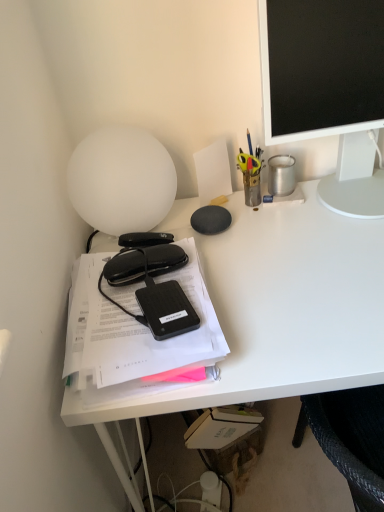
Locate an element on the screen. This screenshot has height=512, width=384. metallic silver pen holder at upper right, placed as the third stationery when sorted from front to back is located at coordinates (281, 175).

You are a GUI agent. You are given a task and a screenshot of the screen. Output one action in this format:
    pyautogui.click(x=<x>, y=<y>)
    Task: Click on the white plastic bottle at lower center, the 1th stationery when ordered from back to front
    The width and height of the screenshot is (384, 512).
    Given the screenshot: What is the action you would take?
    point(210,490)

The image size is (384, 512). What do you see at coordinates (143, 263) in the screenshot?
I see `black matte glasses case at left, the fourth stationery when ordered from right to left` at bounding box center [143, 263].

Identify the location of black matte glasses case at left, the fourth stationery when ordered from right to left. The height and width of the screenshot is (512, 384). (143, 263).

What do you see at coordinates (251, 173) in the screenshot? The width and height of the screenshot is (384, 512). I see `metallic pen holder at upper right, the third stationery positioned from the left` at bounding box center [251, 173].

Find the location of a particular element. This screenshot has width=384, height=512. black matte hardcover at left is located at coordinates (140, 327).

Describe the element at coordinates (140, 327) in the screenshot. The height and width of the screenshot is (512, 384). I see `black matte hardcover at left` at that location.

This screenshot has height=512, width=384. Identify the location of black plastic external hard drive at center. [x=166, y=309].

You are a GUI agent. You are given a task and a screenshot of the screen. Output one action in this format:
    pyautogui.click(x=<x>, y=<y>)
    Task: Click on the metallic silver pen holder at upper right, positioned as the 1th stationery in top-to-bottom order
    
    Given the screenshot: What is the action you would take?
    pyautogui.click(x=281, y=175)

Where is `document located above the white plastic bottle at lower center, which appears as the third stationery when viewed from the right (from a real-world perspective)`? document located above the white plastic bottle at lower center, which appears as the third stationery when viewed from the right (from a real-world perspective) is located at coordinates (140, 327).

Is black matte hardcover at left next to white plastic bottle at lower center, which appears as the fourth stationery when viewed from the front?

They are not placed beside each other.

Does point (84, 257) lie behind point (218, 507)?

No, it is in front of (218, 507).

From the image's perspective, which is above, black matte hardcover at left or white plastic bottle at lower center, the 1th stationery when ordered from back to front?

black matte hardcover at left is shown above in the image.

From a real-world perspective, who is located lower, metallic silver pen holder at upper right, which ranks as the fourth stationery in left-to-right order, or metallic pen holder at upper right, the third stationery positioned from the left?

metallic silver pen holder at upper right, which ranks as the fourth stationery in left-to-right order.

Which point is more distant from viewer, (294, 158) or (251, 161)?

Positioned behind is point (294, 158).

Which object is positioned more to the left, metallic silver pen holder at upper right, which ranks as the fourth stationery in left-to-right order, or metallic pen holder at upper right, the 3th stationery ordered from the bottom?

From the viewer's perspective, metallic pen holder at upper right, the 3th stationery ordered from the bottom, appears more on the left side.

Is metallic silver pen holder at upper right, which ranks as the 2th stationery in back-to-front order, thinner than metallic pen holder at upper right, which is the third stationery from back to front?

No.

Is white matte lamp at upper left next to matte black monitor at upper right and touching it?

white matte lamp at upper left and matte black monitor at upper right are clearly separated.

Between white matte lamp at upper left and matte black monitor at upper right, which one has larger width?

With larger width is matte black monitor at upper right.

Is white matte lamp at upper left not inside matte black monitor at upper right?

Yes, white matte lamp at upper left is not within matte black monitor at upper right.

Is metallic pen holder at upper right, the 3th stationery ordered from the bottom, positioned in front of black plastic external hard drive at center?

No, metallic pen holder at upper right, the 3th stationery ordered from the bottom, is behind black plastic external hard drive at center.

Does metallic pen holder at upper right, the third stationery positioned from the left, have a greater width compared to black plastic external hard drive at center?

Incorrect, the width of metallic pen holder at upper right, the third stationery positioned from the left, does not surpass that of black plastic external hard drive at center.

Is point (248, 168) positioned behind point (172, 336)?

Yes.

What's the angular difference between black matte glasses case at left, which appears as the 4th stationery when viewed from the back, and black matte hardcover at left's facing directions?

The facing directions of black matte glasses case at left, which appears as the 4th stationery when viewed from the back, and black matte hardcover at left are 13.2 degrees apart.

From the image's perspective, which stationery is the 1st one above the black matte hardcover at left? Please provide its 2D coordinates.

[(143, 263)]

Is black matte glasses case at left, the fourth stationery when ordered from right to left, not inside black matte hardcover at left?

That's incorrect, black matte glasses case at left, the fourth stationery when ordered from right to left, is not completely outside black matte hardcover at left.

Is the surface of black matte glasses case at left, the 3th stationery in the top-to-bottom sequence, in direct contact with black matte hardcover at left?

Yes.

Consider the image. Which object is more forward, black plastic external hard drive at center or white matte lamp at upper left?

Positioned in front is black plastic external hard drive at center.

Locate an element on the screen. lamp lying behind the black plastic external hard drive at center is located at coordinates (121, 180).

Between black plastic external hard drive at center and white matte lamp at upper left, which one appears on the left side from the viewer's perspective?

Positioned to the left is white matte lamp at upper left.

In the scene shown: Measure the distance from black plastic external hard drive at center to white matte lamp at upper left.

black plastic external hard drive at center is 9.47 inches away from white matte lamp at upper left.

Who is taller, white plastic bottle at lower center, positioned as the 1th stationery in bottom-to-top order, or matte black monitor at upper right?

With more height is matte black monitor at upper right.

Measure the distance from white plastic bottle at lower center, marked as the 2th stationery in a left-to-right arrangement, to matte black monitor at upper right.

white plastic bottle at lower center, marked as the 2th stationery in a left-to-right arrangement, is 3.42 feet from matte black monitor at upper right.

Considering the relative sizes of white plastic bottle at lower center, the 4th stationery in the top-to-bottom sequence, and matte black monitor at upper right in the image provided, is white plastic bottle at lower center, the 4th stationery in the top-to-bottom sequence, smaller than matte black monitor at upper right?

Yes.

From a real-world perspective, is white plastic bottle at lower center, the 4th stationery in the top-to-bottom sequence, physically above matte black monitor at upper right?

Actually, white plastic bottle at lower center, the 4th stationery in the top-to-bottom sequence, is physically below matte black monitor at upper right in the real world.

Locate an element on the screen. document on the left of white plastic bottle at lower center, the 4th stationery in the top-to-bottom sequence is located at coordinates (140, 327).

From a real-world perspective, starting from the metallic pen holder at upper right, the second stationery from the front, which stationery is the 1st one below it? Please provide its 2D coordinates.

[(281, 175)]

Which object lies further to the anchor point black matte glasses case at left, which appears as the 4th stationery when viewed from the back, white matte desk at left or white plastic bottle at lower center, the 4th stationery in the top-to-bottom sequence?

white plastic bottle at lower center, the 4th stationery in the top-to-bottom sequence.

Looking at the image, which one is located further to black matte hardcover at left, black matte glasses case at left, which appears as the 4th stationery when viewed from the back, or black plastic external hard drive at center?

black matte glasses case at left, which appears as the 4th stationery when viewed from the back.

Considering their positions, is matte black monitor at upper right positioned further to metallic pen holder at upper right, marked as the second stationery in a top-to-bottom arrangement, than black matte glasses case at left, which appears as the 4th stationery when viewed from the back?

black matte glasses case at left, which appears as the 4th stationery when viewed from the back.

From the image, which object appears to be farther from matte black monitor at upper right, white plastic bottle at lower center, marked as the 2th stationery in a left-to-right arrangement, or black matte glasses case at left, the fourth stationery when ordered from right to left?

Among the two, white plastic bottle at lower center, marked as the 2th stationery in a left-to-right arrangement, is located further to matte black monitor at upper right.

Estimate the real-world distances between objects in this image. Which object is closer to metallic silver pen holder at upper right, which ranks as the 2th stationery in back-to-front order, white plastic bottle at lower center, the 1th stationery when ordered from back to front, or matte black monitor at upper right?

matte black monitor at upper right is positioned closer to the anchor metallic silver pen holder at upper right, which ranks as the 2th stationery in back-to-front order.

Which object lies nearer to the anchor point black plastic external hard drive at center, black matte hardcover at left or white matte desk at left?

black matte hardcover at left lies closer to black plastic external hard drive at center than the other object.

Estimate the real-world distances between objects in this image. Which object is closer to matte black monitor at upper right, black matte glasses case at left, the fourth stationery when ordered from right to left, or metallic silver pen holder at upper right, placed as the third stationery when sorted from front to back?

metallic silver pen holder at upper right, placed as the third stationery when sorted from front to back, is positioned closer to the anchor matte black monitor at upper right.

Considering their positions, is metallic pen holder at upper right, which is the third stationery from back to front, positioned closer to metallic silver pen holder at upper right, placed as the third stationery when sorted from front to back, than white matte lamp at upper left?

metallic pen holder at upper right, which is the third stationery from back to front, is closer to metallic silver pen holder at upper right, placed as the third stationery when sorted from front to back.

Identify the location of stationery between white matte lamp at upper left and black matte hardcover at left from top to bottom. (143, 263).

This screenshot has width=384, height=512. Identify the location of lamp between metallic pen holder at upper right, the second stationery from the right, and white plastic bottle at lower center, which appears as the fourth stationery when viewed from the front, in the vertical direction. (121, 180).

This screenshot has height=512, width=384. I want to click on stationery between metallic pen holder at upper right, the second stationery from the front, and black plastic external hard drive at center from top to bottom, so click(143, 263).

Find the location of a particular element. The width and height of the screenshot is (384, 512). document between metallic silver pen holder at upper right, positioned as the 1th stationery in top-to-bottom order, and white plastic bottle at lower center, positioned as the 1th stationery in bottom-to-top order, from top to bottom is located at coordinates (140, 327).